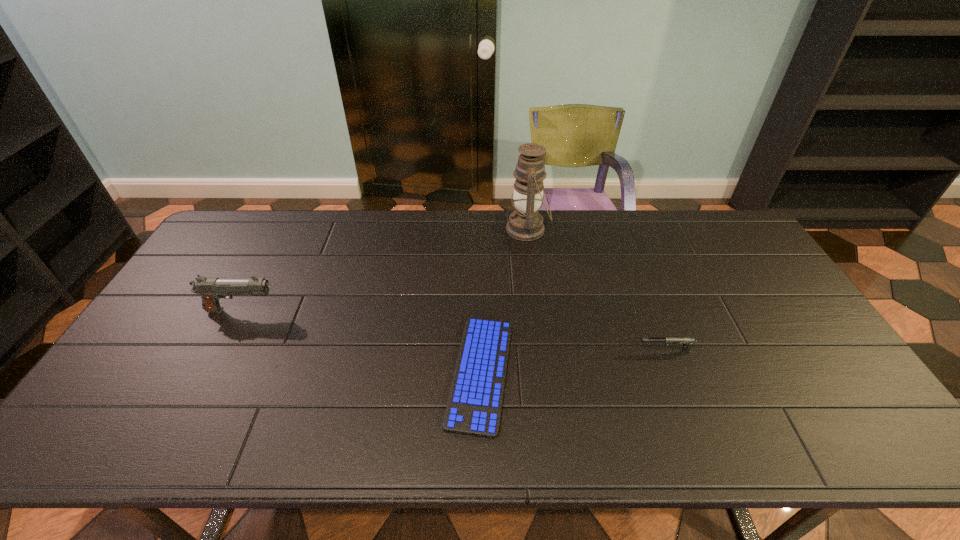
Where is `vacant area between the left gun and the oil lamp`? The height and width of the screenshot is (540, 960). vacant area between the left gun and the oil lamp is located at coordinates (385, 270).

You are a GUI agent. You are given a task and a screenshot of the screen. Output one action in this format:
    pyautogui.click(x=<x>, y=<y>)
    Task: Click on the vacant area between the third object from right to left and the farther gun
    The height and width of the screenshot is (540, 960).
    Given the screenshot: What is the action you would take?
    click(x=361, y=342)

This screenshot has width=960, height=540. Identify the location of object that is the second closest to the second tallest object. (525, 223).

Identify which object is the second closest to the oil lamp. Please provide its 2D coordinates. Your answer should be formatted as a tuple, i.e. [(x, y)], where the tuple contains the x and y coordinates of a point satisfying the conditions above.

[(685, 342)]

This screenshot has height=540, width=960. Find the location of `vacant space that satisfies the following two spatial constraints: 1. in the direction the farther gun is aimed; 2. on the back side of the shortest object`. vacant space that satisfies the following two spatial constraints: 1. in the direction the farther gun is aimed; 2. on the back side of the shortest object is located at coordinates (208, 374).

You are a GUI agent. You are given a task and a screenshot of the screen. Output one action in this format:
    pyautogui.click(x=<x>, y=<y>)
    Task: Click on the vacant space that satisfies the following two spatial constraints: 1. in the direction the taller gun is aimed; 2. on the right side of the shortest object
    Image resolution: width=960 pixels, height=540 pixels.
    Given the screenshot: What is the action you would take?
    pyautogui.click(x=208, y=374)